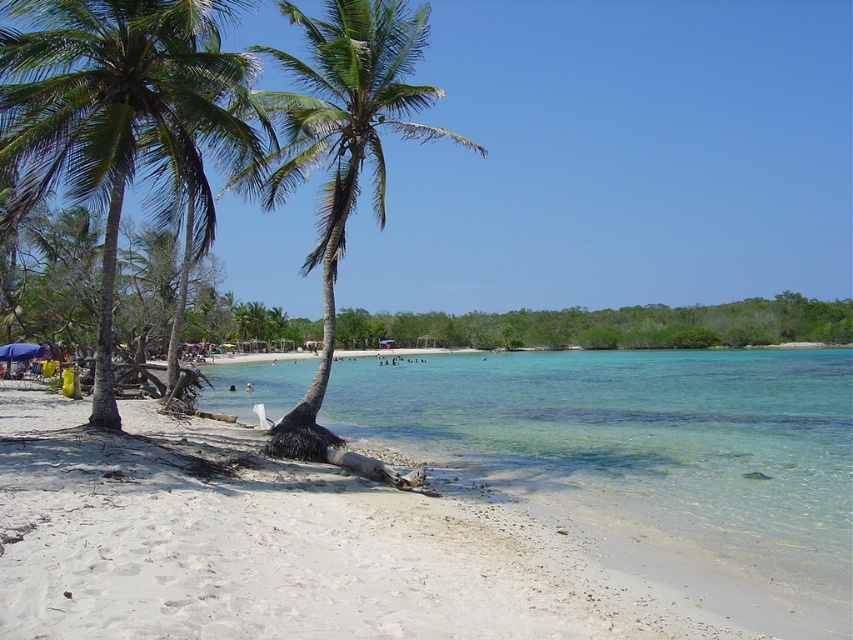
You are standing on the beach looking out at the sea. There are two points marked on the image. The first is at coordinates point (337,476) and the second is at point (395,65). Which point is closer to you?

Point (337,476) is closer to the viewer than point (395,65).

You are standing on the sandy beach and want to find the tallest palm tree between the green leafy palm tree at left and the green leafy palm tree at center. Which one should you look towards?

The green leafy palm tree at center is taller than the green leafy palm tree at left, so you should look towards the center palm tree.